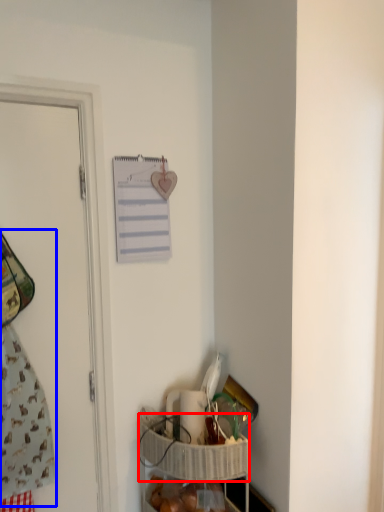
Question: Which point is further to the camera, basket (highlighted by a red box) or laundry (highlighted by a blue box)?

Choices:
 (A) basket
 (B) laundry

Answer: (A)